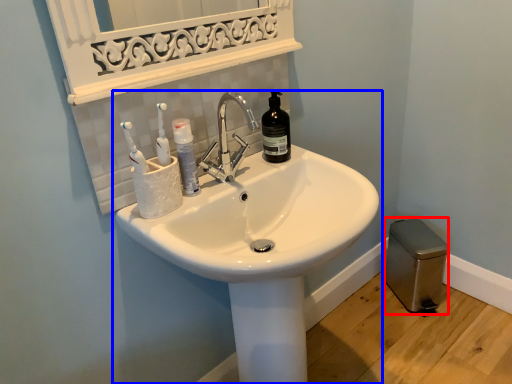
Question: Which of the following is the closest to the observer, gray (highlighted by a red box) or sink (highlighted by a blue box)?

Choices:
 (A) gray
 (B) sink

Answer: (B)